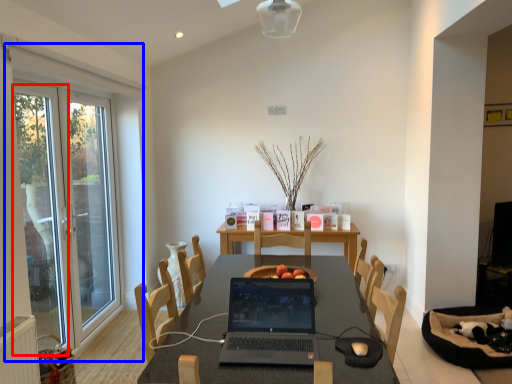
Question: Among these objects, which one is nearest to the camera, screen door (highlighted by a red box) or window (highlighted by a blue box)?

Choices:
 (A) screen door
 (B) window

Answer: (A)